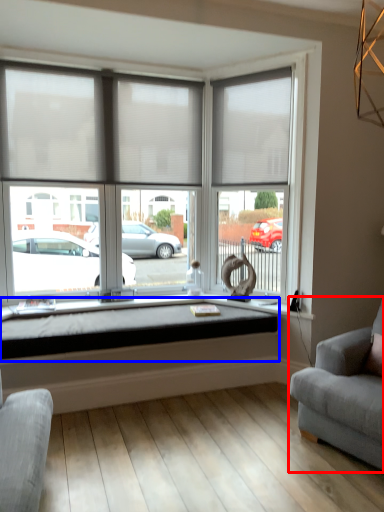
Question: Which object appears farthest to the camera in this image, studio couch (highlighted by a red box) or window sill (highlighted by a blue box)?

Choices:
 (A) studio couch
 (B) window sill

Answer: (B)